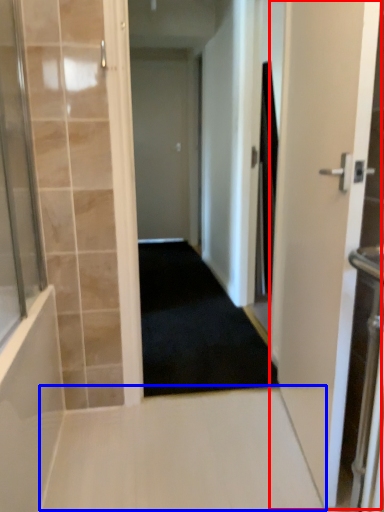
Question: Among these objects, which one is farthest to the camera, door (highlighted by a red box) or path (highlighted by a blue box)?

Choices:
 (A) door
 (B) path

Answer: (B)